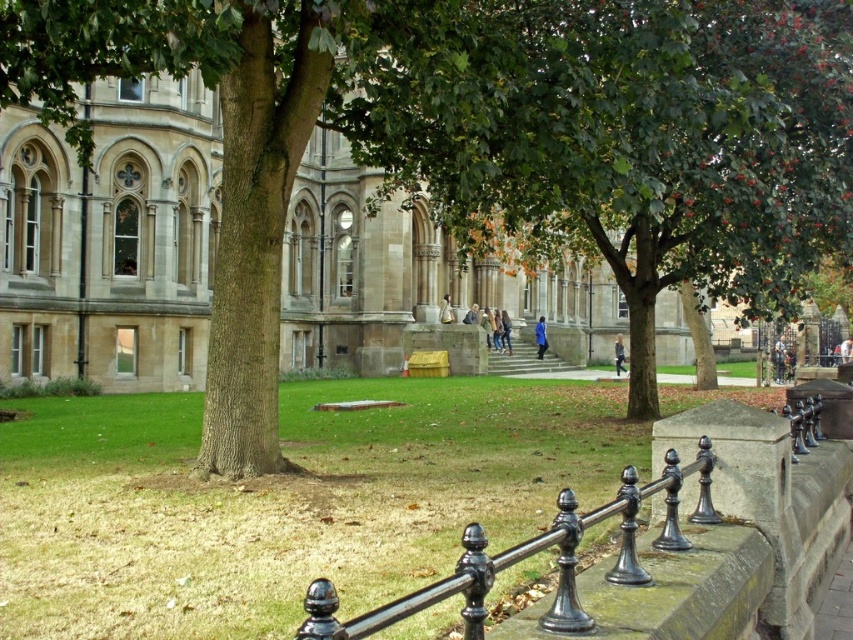
What do you see at coordinates (616, 136) in the screenshot?
I see `green leafy tree at center` at bounding box center [616, 136].

Which is behind, point (457, 1) or point (677, 548)?

Positioned behind is point (457, 1).

Who is more forward, (621, 204) or (518, 556)?

Point (518, 556) is in front.

Where is `green leafy tree at center`? The image size is (853, 640). green leafy tree at center is located at coordinates (616, 136).